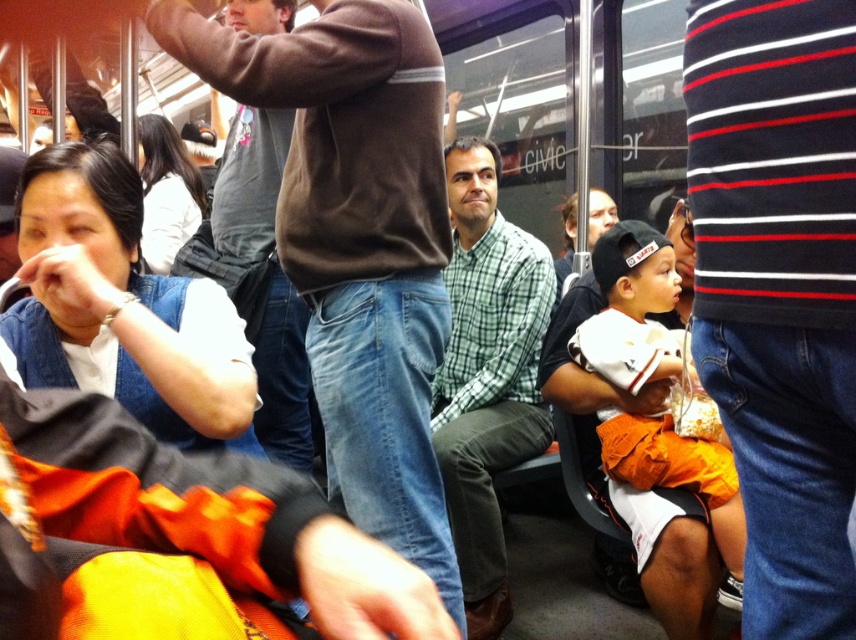
This screenshot has width=856, height=640. I want to click on black striped sweater at upper right, so click(779, 289).

Between black striped sweater at upper right and brown sweater at center, which one is positioned higher?

brown sweater at center is higher up.

Identify the location of black striped sweater at upper right. (779, 289).

Find the location of a particular element. This screenshot has width=856, height=640. black striped sweater at upper right is located at coordinates (779, 289).

Does black striped sweater at upper right appear under green checkered shirt at center?

No, black striped sweater at upper right is not below green checkered shirt at center.

Which of these two, black striped sweater at upper right or green checkered shirt at center, stands taller?

green checkered shirt at center

Is point (794, 225) positioned in front of point (545, 259)?

Yes, it is.

Locate an element on the screen. This screenshot has width=856, height=640. black striped sweater at upper right is located at coordinates (779, 289).

Which of these two, brown sweater at center or green checkered shirt at center, stands shorter?

brown sweater at center

Does point (361, 129) come behind point (479, 365)?

No, it is not.

Who is more forward, (393, 301) or (479, 387)?

Point (393, 301) is in front.

Locate an element on the screen. brown sweater at center is located at coordinates (357, 243).